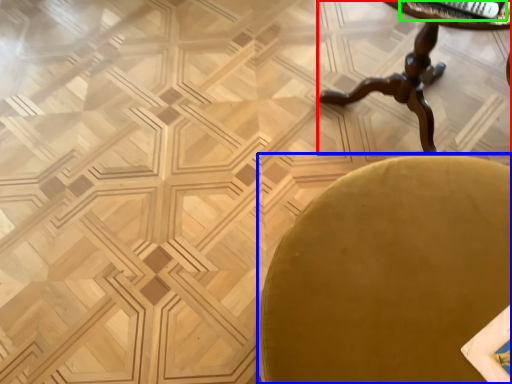
Question: Based on their relative distances, which object is farther from table (highlighted by a red box)? Choose from chair (highlighted by a blue box) and magazine (highlighted by a green box).

Choices:
 (A) chair
 (B) magazine

Answer: (A)